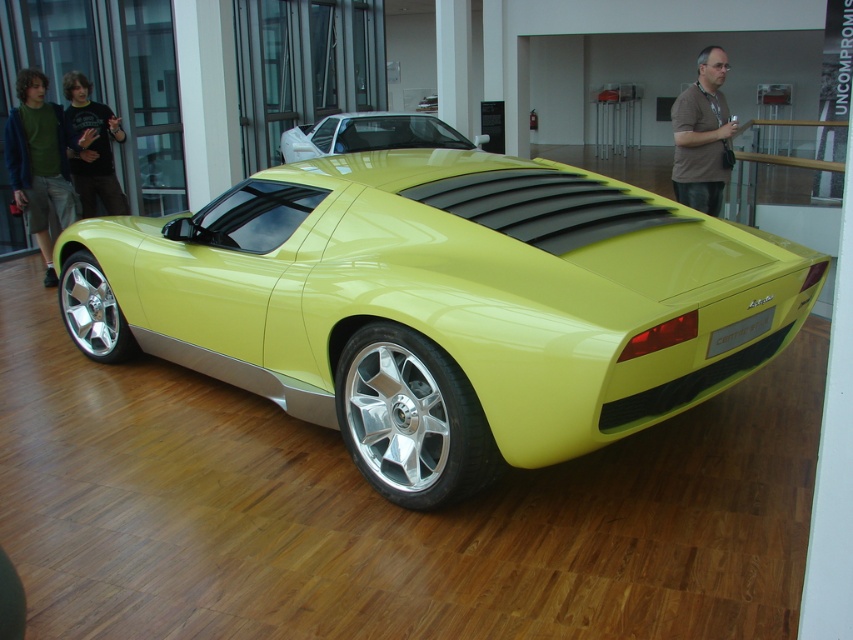
Question: Based on their relative distances, which object is farther from the matte black t-shirt at left?

Choices:
 (A) brownmaterial shirt at right
 (B) lime glossy/sleek sports car at center
 (C) glossy yellow car at center
 (D) green cotton shirt at left

Answer: (A)

Question: Estimate the real-world distances between objects in this image. Which object is farther from the brownmaterial shirt at right?

Choices:
 (A) green cotton shirt at left
 (B) matte black t-shirt at left

Answer: (A)

Question: Is lime glossy/sleek sports car at center to the right of matte black t-shirt at left from the viewer's perspective?

Choices:
 (A) no
 (B) yes

Answer: (B)

Question: Which point is farther to the camera?

Choices:
 (A) (90, 150)
 (B) (351, 115)
 (C) (711, 134)

Answer: (B)

Question: Is green cotton shirt at left smaller than matte black t-shirt at left?

Choices:
 (A) yes
 (B) no

Answer: (B)

Question: In this image, where is lime glossy/sleek sports car at center located relative to glossy yellow car at center?

Choices:
 (A) right
 (B) left

Answer: (A)